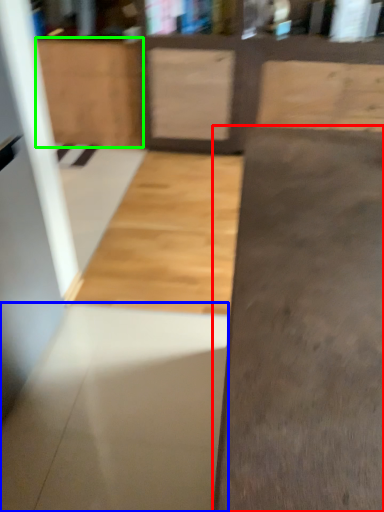
Question: Which object is positioned closest to concrete (highlighted by a red box)? Select from concrete (highlighted by a blue box) and cabinetry (highlighted by a green box).

Choices:
 (A) concrete
 (B) cabinetry

Answer: (A)